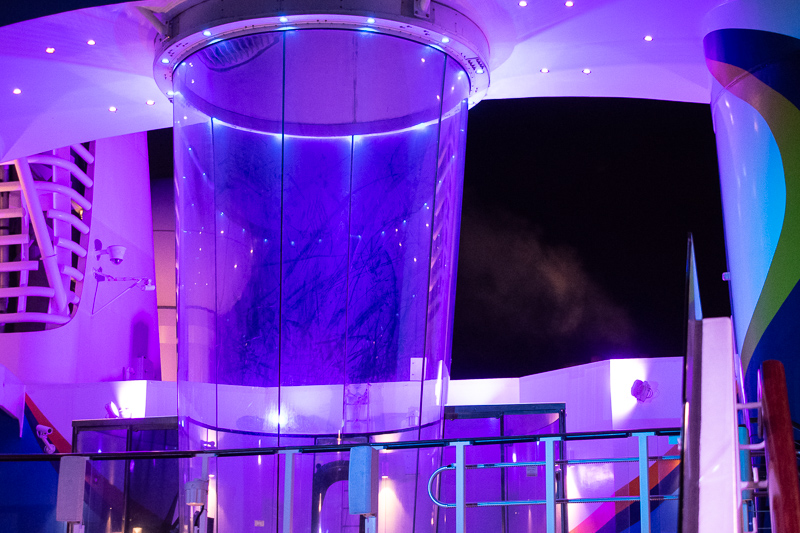
At what (x,y) coordinates should I click in order to perform the action: click on light. Please return your answer as a coordinate pair (x, y). Looking at the image, I should click on (148, 285).